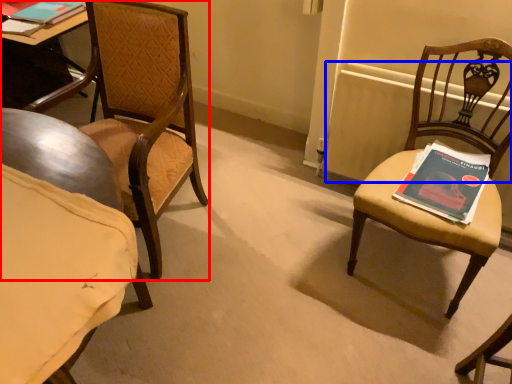
Question: Among these objects, which one is farthest to the camera, chair (highlighted by a red box) or radiator (highlighted by a blue box)?

Choices:
 (A) chair
 (B) radiator

Answer: (B)